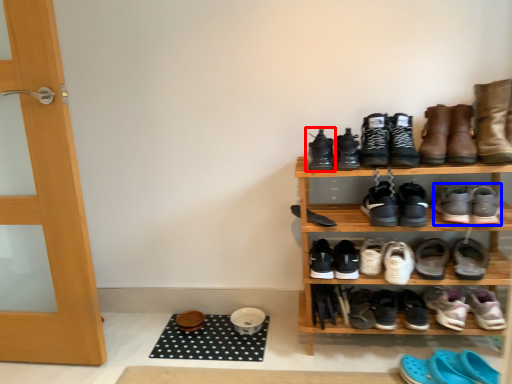
Question: Which of the following is the closest to the observer, footwear (highlighted by a red box) or footwear (highlighted by a blue box)?

Choices:
 (A) footwear
 (B) footwear

Answer: (B)